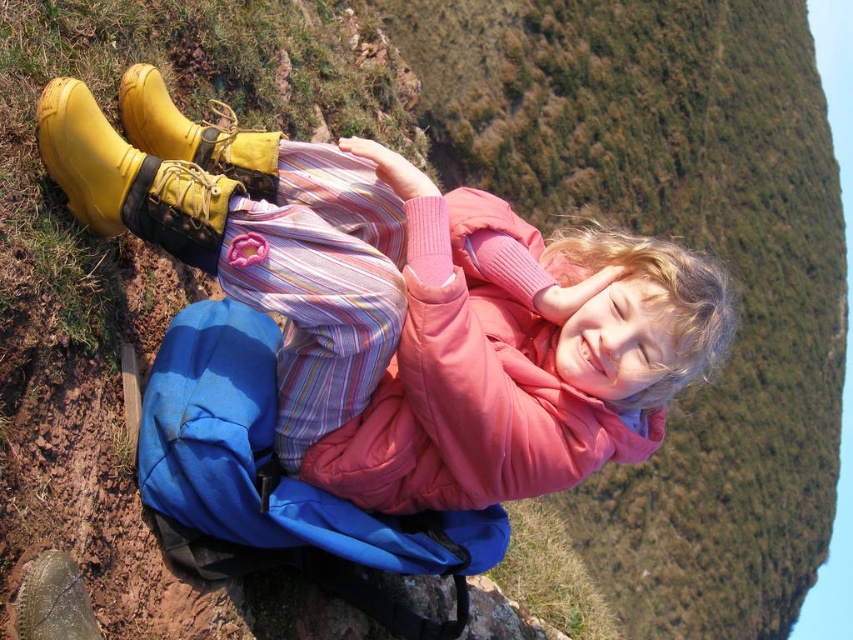
Question: Which object is farther from the camera taking this photo?

Choices:
 (A) yellow rubber boots at upper left
 (B) blue quilted sleeping bag at center

Answer: (B)

Question: Which point is farther to the camera?

Choices:
 (A) (88, 150)
 (B) (317, 385)
 (C) (189, 451)
 (D) (276, 163)

Answer: (D)

Question: Which object appears closest to the camera in this image?

Choices:
 (A) yellow rubber boots at upper left
 (B) rubber/yellow boot at left
 (C) yellow rubber boot at left
 (D) blue quilted sleeping bag at center

Answer: (C)

Question: Does yellow rubber boots at upper left have a larger size compared to yellow rubber boot at left?

Choices:
 (A) no
 (B) yes

Answer: (B)

Question: Can you confirm if blue quilted sleeping bag at center is smaller than rubber/yellow boot at left?

Choices:
 (A) yes
 (B) no

Answer: (B)

Question: Can you confirm if blue quilted sleeping bag at center is positioned to the left of rubber/yellow boot at left?

Choices:
 (A) yes
 (B) no

Answer: (B)